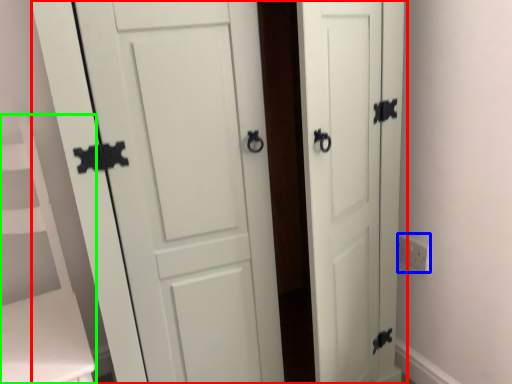
Question: Which is nearer to the door (highlighted by a red box)? electric outlet (highlighted by a blue box) or vanity (highlighted by a green box).

Choices:
 (A) electric outlet
 (B) vanity

Answer: (B)